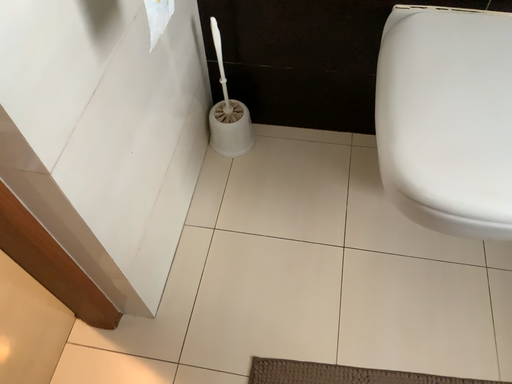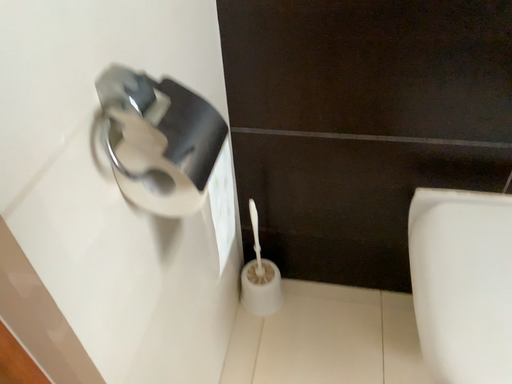
Question: Which way did the camera rotate in the video?

Choices:
 (A) rotated downward
 (B) rotated upward

Answer: (B)